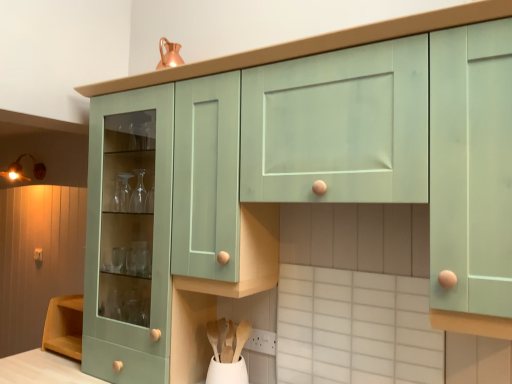
Question: From a real-world perspective, relative to matte gold light fixture at upper left, is matte wooden knob at lower left vertically above or below?

Choices:
 (A) below
 (B) above

Answer: (A)

Question: Is matte wooden knob at lower left bigger or smaller than matte gold light fixture at upper left?

Choices:
 (A) big
 (B) small

Answer: (B)

Question: Estimate the real-world distances between objects in this image. Which object is closer to the wooden at lower center, which is the 1th spoon from right to left?

Choices:
 (A) matte wooden knob at lower left
 (B) white plastic power plugs and sockets at lower center
 (C) wooden at lower center, which is the second spoon in right-to-left order
 (D) matte gold light fixture at upper left
 (E) mint green cabinet at center

Answer: (B)

Question: Which object is positioned farthest from the wooden at lower center, which is the 1th spoon from right to left?

Choices:
 (A) matte gold light fixture at upper left
 (B) wooden at lower center, the first spoon when ordered from left to right
 (C) white matte vase at lower center
 (D) mint green cabinet at center
 (E) white plastic power plugs and sockets at lower center

Answer: (A)